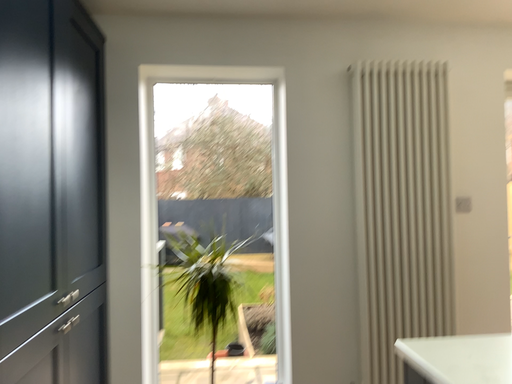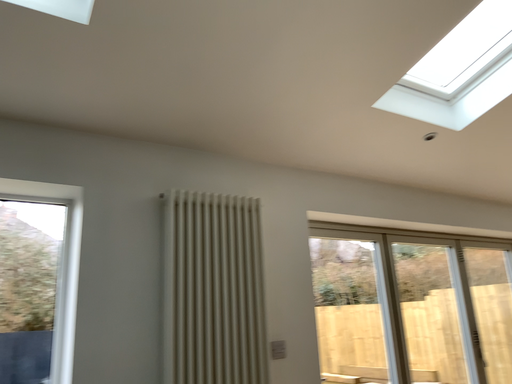
Question: How did the camera likely rotate when shooting the video?

Choices:
 (A) rotated right
 (B) rotated left

Answer: (A)